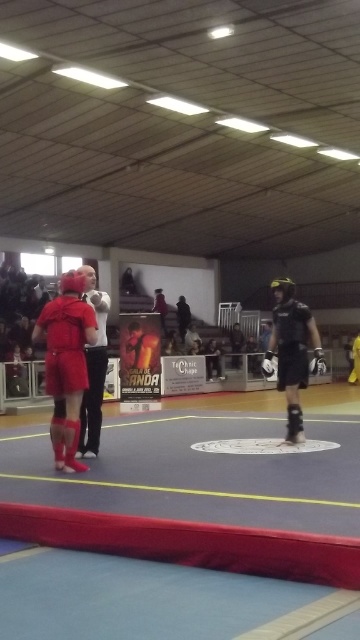
Question: Can you confirm if matte red boxing gear at left is positioned to the left of matte black referee at center?

Choices:
 (A) no
 (B) yes

Answer: (B)

Question: Does matte red boxing gear at left have a lesser width compared to matte black referee at center?

Choices:
 (A) no
 (B) yes

Answer: (A)

Question: Can you confirm if matte red boxing gear at left is bigger than matte black referee at center?

Choices:
 (A) yes
 (B) no

Answer: (A)

Question: Which object appears closest to the camera in this image?

Choices:
 (A) matte black referee at center
 (B) black matte uniform at center
 (C) matte red boxing gear at left

Answer: (C)

Question: Considering the real-world distances, which object is farthest from the black matte uniform at center?

Choices:
 (A) matte black referee at center
 (B) matte red boxing gear at left

Answer: (B)

Question: Which point appears closest to the camera in this image?

Choices:
 (A) (72, 440)
 (B) (99, 308)
 (C) (289, 285)

Answer: (A)